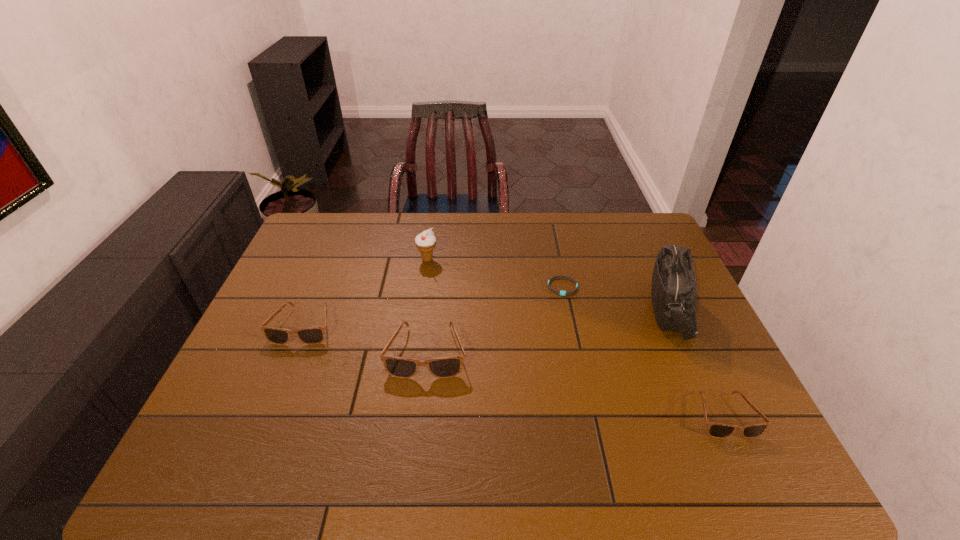
Find the location of a particular element. The width and height of the screenshot is (960, 540). sunglasses identified as the second closest to the third shortest object is located at coordinates (716, 430).

At what (x,y) coordinates should I click in order to perform the action: click on sunglasses that is the third closest to the shoulder bag. Please return your answer as a coordinate pair (x, y). The width and height of the screenshot is (960, 540). Looking at the image, I should click on (314, 335).

This screenshot has height=540, width=960. Find the location of `blank space that satisfies the following two spatial constraints: 1. at the front padded panel of the tallest object; 2. on the frames of the tallest sunglasses`. blank space that satisfies the following two spatial constraints: 1. at the front padded panel of the tallest object; 2. on the frames of the tallest sunglasses is located at coordinates (691, 352).